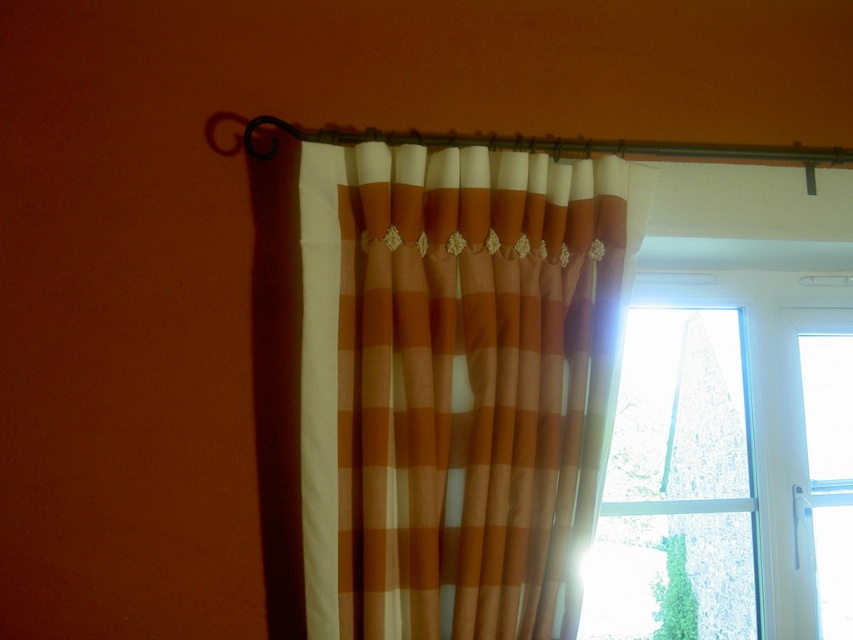
Between orange and white checkered curtain at center and transparent glass window at right, which one is positioned lower?

transparent glass window at right

Consider the image. Is orange and white checkered curtain at center taller than transparent glass window at right?

Correct, orange and white checkered curtain at center is much taller as transparent glass window at right.

Between point (422, 168) and point (717, 488), which one is positioned behind?

Positioned behind is point (717, 488).

You are a GUI agent. You are given a task and a screenshot of the screen. Output one action in this format:
    pyautogui.click(x=<x>, y=<y>)
    Task: Click on the orange and white checkered curtain at center
    The image size is (853, 640).
    Given the screenshot: What is the action you would take?
    pyautogui.click(x=456, y=384)